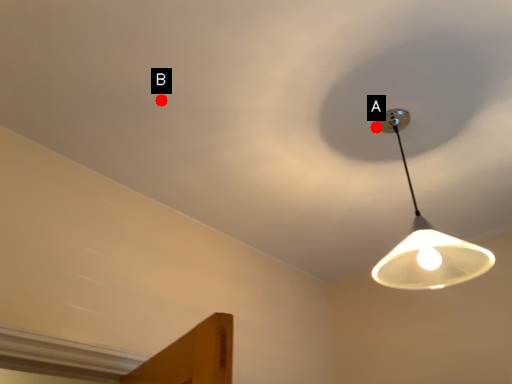
Question: Two points are circled on the image, labeled by A and B beside each circle. Which point appears farthest from the camera in this image?

Choices:
 (A) A is further
 (B) B is further

Answer: (A)